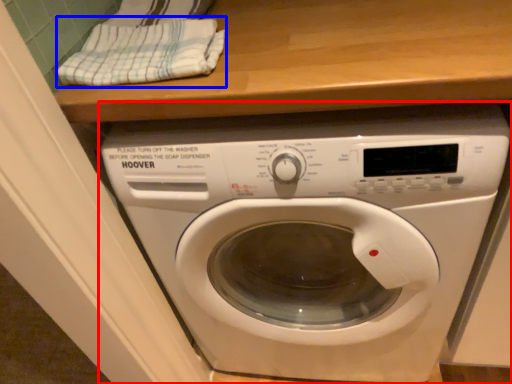
Question: Which object is closer to the camera taking this photo, washing machine (highlighted by a red box) or clothe (highlighted by a blue box)?

Choices:
 (A) washing machine
 (B) clothe

Answer: (A)